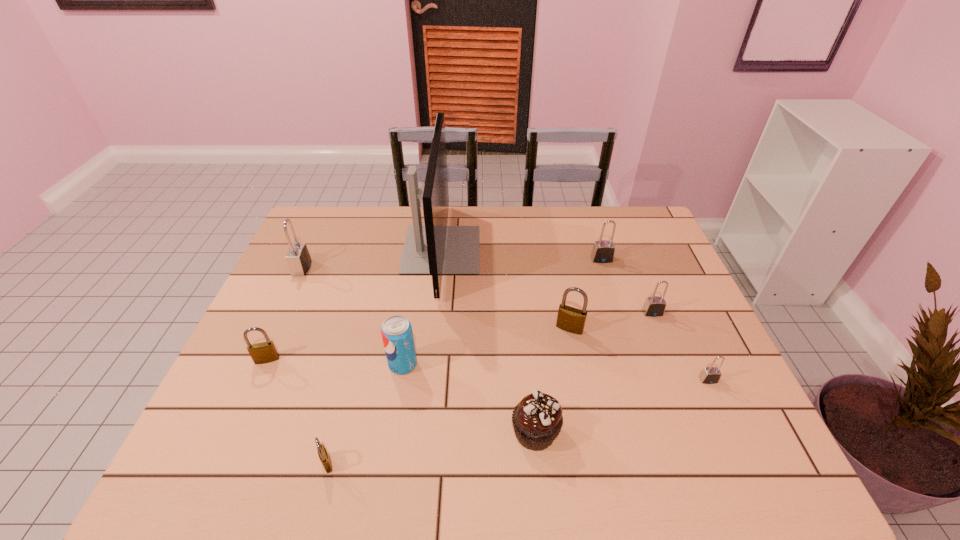
Find the location of a particular element. free region located on the shackle of the second biggest gray padlock is located at coordinates (636, 363).

Locate an element on the screen. blank area located 0.190m on the back of the farthest brass padlock is located at coordinates (559, 276).

This screenshot has height=540, width=960. What are the coordinates of `free space located 0.140m on the right of the soda can` in the screenshot? It's located at (472, 364).

In order to click on free space located 0.260m on the front of the leftmost brass padlock in this screenshot , I will do `click(220, 467)`.

Find the location of `vacant region located 0.280m on the shackle of the third farthest gray padlock`. vacant region located 0.280m on the shackle of the third farthest gray padlock is located at coordinates [x=689, y=406].

I want to click on vacant space located 0.180m on the right of the fifth object from right to left, so click(641, 432).

Locate an element on the screen. The width and height of the screenshot is (960, 540). free space located on the shackle of the smallest gray padlock is located at coordinates point(737,443).

Locate an element on the screen. Image resolution: width=960 pixels, height=540 pixels. vacant space located 0.230m on the right of the second brass padlock from right to left is located at coordinates (444, 463).

At what (x,y) coordinates should I click in order to perform the action: click on object present at the far edge. Please return your answer as a coordinate pair (x, y). This screenshot has width=960, height=540. Looking at the image, I should click on (435, 249).

Locate an element on the screen. Image resolution: width=960 pixels, height=540 pixels. cupcake situated at the near edge is located at coordinates (537, 420).